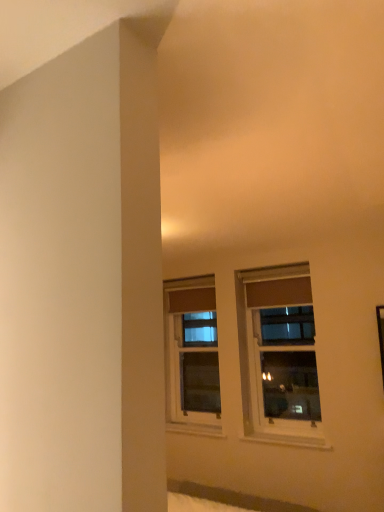
Question: Which direction should I rotate to look at clear glass window at center, which appears as the second window when viewed from the back?

Choices:
 (A) right
 (B) left

Answer: (A)

Question: Is matte brown window at center, which is the 2th window from right to left, thinner than clear glass window at center, which appears as the second window when viewed from the back?

Choices:
 (A) no
 (B) yes

Answer: (A)

Question: Does matte brown window at center, which is the 2th window from right to left, have a greater width compared to clear glass window at center, placed as the first window when sorted from right to left?

Choices:
 (A) yes
 (B) no

Answer: (A)

Question: From a real-world perspective, is matte brown window at center, marked as the first window in a left-to-right arrangement, on clear glass window at center, marked as the second window in a left-to-right arrangement?

Choices:
 (A) no
 (B) yes

Answer: (B)

Question: Is matte brown window at center, which is the first window from back to front, located outside clear glass window at center, which appears as the second window when viewed from the back?

Choices:
 (A) yes
 (B) no

Answer: (A)

Question: From a real-world perspective, is matte brown window at center, which is the 2th window from right to left, under clear glass window at center, marked as the second window in a left-to-right arrangement?

Choices:
 (A) yes
 (B) no

Answer: (B)

Question: Is matte brown window at center, the 2th window positioned from the front, oriented towards clear glass window at center, marked as the second window in a left-to-right arrangement?

Choices:
 (A) yes
 (B) no

Answer: (B)

Question: From the image's perspective, is clear glass window at center, arranged as the first window when viewed from the front, beneath matte brown window at center, which is the first window from back to front?

Choices:
 (A) no
 (B) yes

Answer: (A)

Question: Does clear glass window at center, arranged as the first window when viewed from the front, have a lesser width compared to matte brown window at center, the 2th window positioned from the front?

Choices:
 (A) yes
 (B) no

Answer: (A)

Question: Considering the relative sizes of clear glass window at center, marked as the second window in a left-to-right arrangement, and matte brown window at center, the 2th window positioned from the front, in the image provided, is clear glass window at center, marked as the second window in a left-to-right arrangement, shorter than matte brown window at center, the 2th window positioned from the front,?

Choices:
 (A) yes
 (B) no

Answer: (B)

Question: Does clear glass window at center, placed as the first window when sorted from right to left, appear on the left side of matte brown window at center, which is the first window from back to front?

Choices:
 (A) no
 (B) yes

Answer: (A)

Question: Can you confirm if clear glass window at center, placed as the first window when sorted from right to left, is positioned to the right of matte brown window at center, the 2th window positioned from the front?

Choices:
 (A) no
 (B) yes

Answer: (B)

Question: Could you tell me if clear glass window at center, which appears as the second window when viewed from the back, is facing matte brown window at center, marked as the first window in a left-to-right arrangement?

Choices:
 (A) no
 (B) yes

Answer: (A)

Question: Based on their sizes in the image, would you say clear glass window at center, arranged as the first window when viewed from the front, is bigger or smaller than matte brown window at center, which is the first window from back to front?

Choices:
 (A) small
 (B) big

Answer: (A)